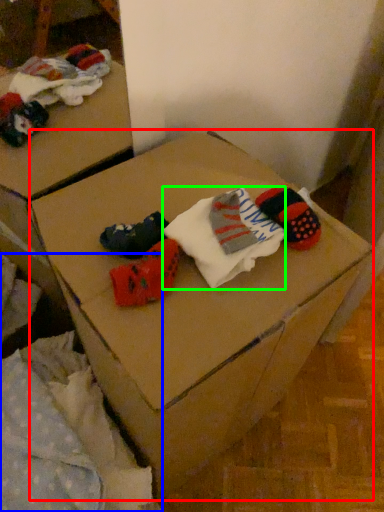
Question: Which is farther away from furniture (highlighted by a red box)? bedding (highlighted by a blue box) or sock (highlighted by a green box)?

Choices:
 (A) bedding
 (B) sock

Answer: (A)